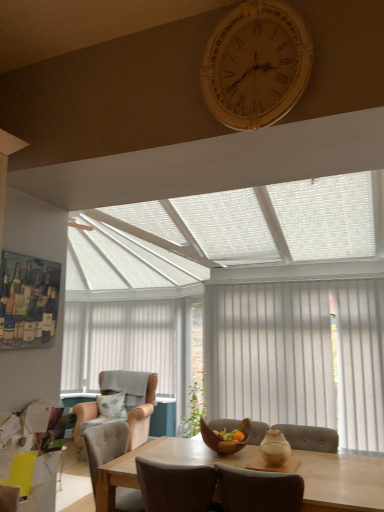
Question: Can you confirm if beige fabric armchair at left, arranged as the second chair when viewed from the front, is taller than white vertical blinds at right?

Choices:
 (A) no
 (B) yes

Answer: (A)

Question: Is beige fabric armchair at left, the first chair positioned from the back, not within white vertical blinds at right?

Choices:
 (A) yes
 (B) no

Answer: (A)

Question: Considering the relative sizes of beige fabric armchair at left, which appears as the 2th chair when viewed from the top, and white vertical blinds at right in the image provided, is beige fabric armchair at left, which appears as the 2th chair when viewed from the top, smaller than white vertical blinds at right?

Choices:
 (A) yes
 (B) no

Answer: (B)

Question: Is the depth of beige fabric armchair at left, the first chair positioned from the back, greater than that of white vertical blinds at right?

Choices:
 (A) yes
 (B) no

Answer: (A)

Question: Considering the relative positions of beige fabric armchair at left, acting as the first chair starting from the bottom, and white vertical blinds at right in the image provided, is beige fabric armchair at left, acting as the first chair starting from the bottom, to the left of white vertical blinds at right from the viewer's perspective?

Choices:
 (A) yes
 (B) no

Answer: (A)

Question: Considering the relative sizes of beige fabric armchair at left, arranged as the second chair when viewed from the front, and white vertical blinds at right in the image provided, is beige fabric armchair at left, arranged as the second chair when viewed from the front, wider than white vertical blinds at right?

Choices:
 (A) yes
 (B) no

Answer: (A)

Question: Does white vertical blinds at right have a lesser width compared to beige fabric armchair at left, the first chair positioned from the back?

Choices:
 (A) no
 (B) yes

Answer: (B)

Question: From the image's perspective, would you say white vertical blinds at right is positioned over beige fabric armchair at left, acting as the first chair starting from the bottom?

Choices:
 (A) no
 (B) yes

Answer: (B)

Question: Is white vertical blinds at right oriented away from beige fabric armchair at left, which appears as the 2th chair when viewed from the top?

Choices:
 (A) yes
 (B) no

Answer: (B)

Question: Is white vertical blinds at right closer to the viewer compared to beige fabric armchair at left, arranged as the second chair when viewed from the front?

Choices:
 (A) no
 (B) yes

Answer: (B)

Question: Is white vertical blinds at right not inside beige fabric armchair at left, which appears as the 2th chair when viewed from the top?

Choices:
 (A) no
 (B) yes

Answer: (B)

Question: From a real-world perspective, is white vertical blinds at right positioned over beige fabric armchair at left, which appears as the 2th chair when viewed from the top, based on gravity?

Choices:
 (A) no
 (B) yes

Answer: (B)

Question: Does beige fabric blind at center have a smaller size compared to white vertical blinds at right?

Choices:
 (A) yes
 (B) no

Answer: (B)